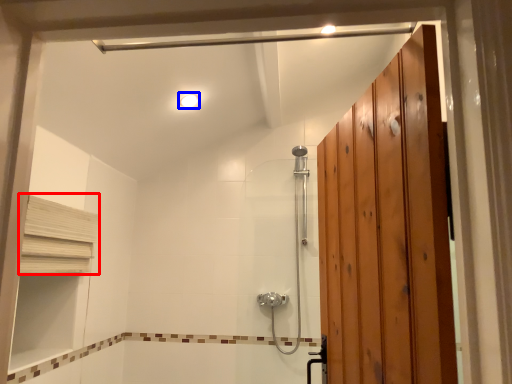
Question: Which object appears closest to the camera in this image, shelf (highlighted by a red box) or light fixture (highlighted by a blue box)?

Choices:
 (A) shelf
 (B) light fixture

Answer: (A)